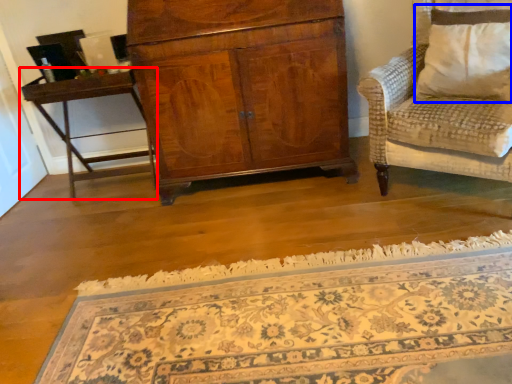
Question: Which of the following is the farthest to the observer, table (highlighted by a red box) or pillow (highlighted by a blue box)?

Choices:
 (A) table
 (B) pillow

Answer: (A)